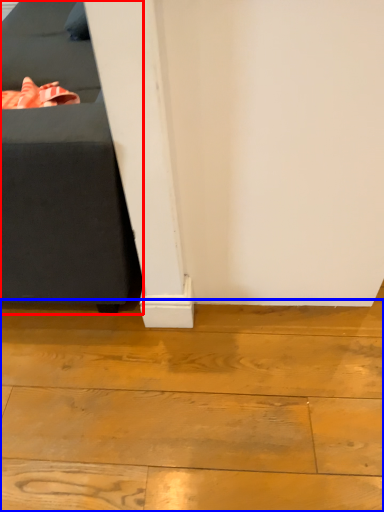
Question: Which of the following is the farthest to the observer, furniture (highlighted by a red box) or wood (highlighted by a blue box)?

Choices:
 (A) furniture
 (B) wood

Answer: (B)